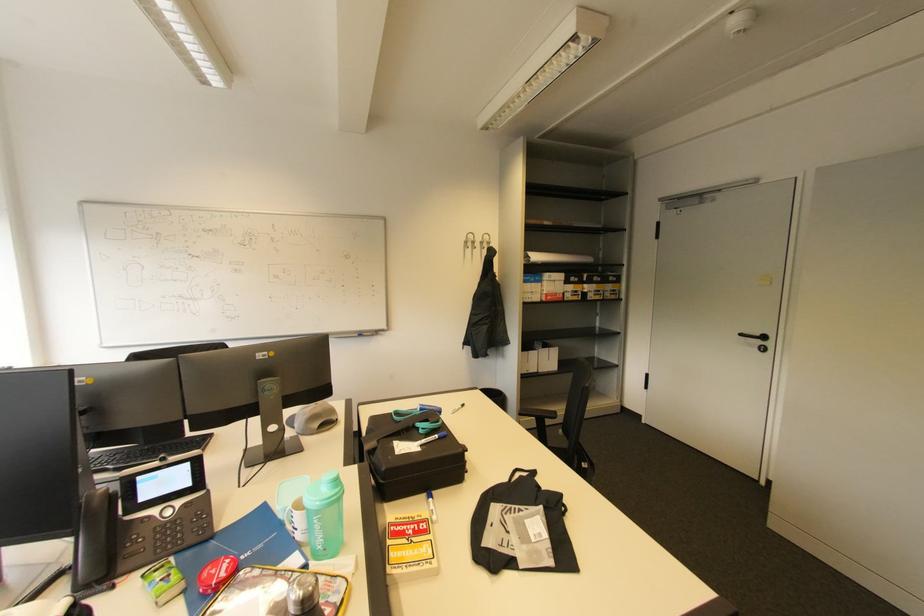
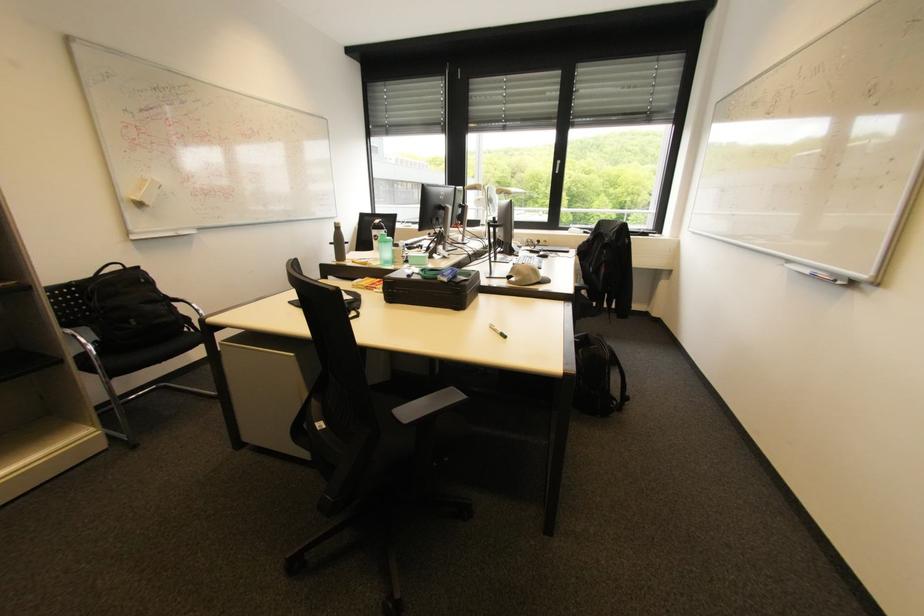
Question: I am providing you with two images of the same scene from different viewpoints. Which of the following objects are not visible in image2?

Choices:
 (A) black chair armrest
 (B) black drawstring bag
 (C) pink toy ball
 (D) white window handle

Answer: (B)